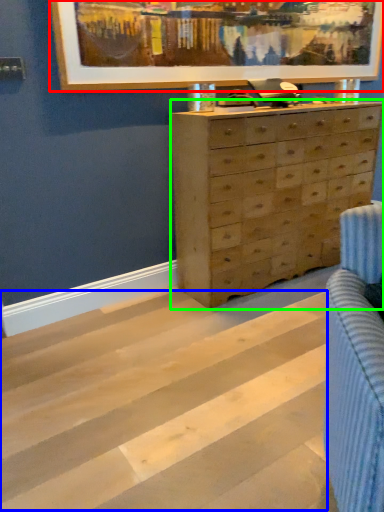
Question: Considering the real-world distances, which object is closest to picture frame (highlighted by a red box)? stripe (highlighted by a blue box) or chest of drawers (highlighted by a green box).

Choices:
 (A) stripe
 (B) chest of drawers

Answer: (B)